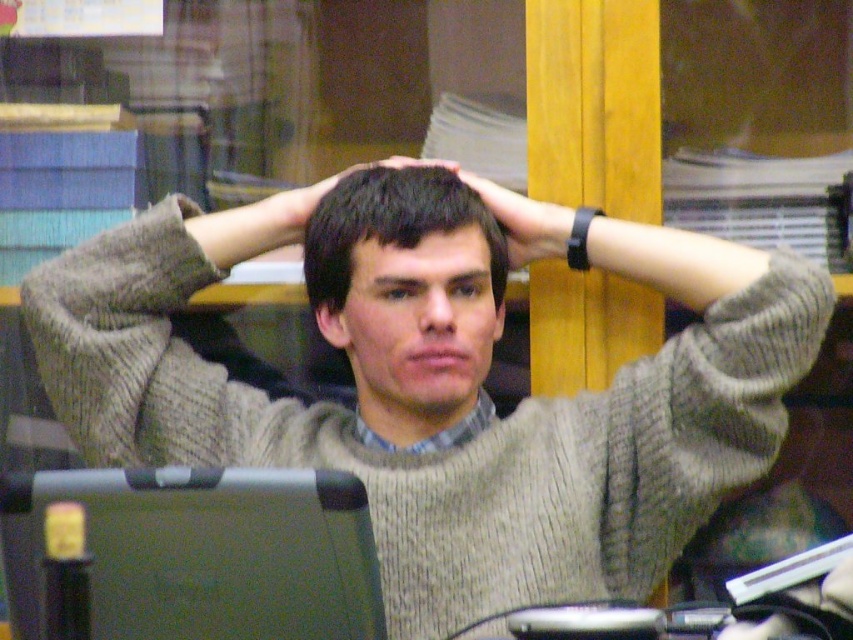
Is gray knitted sweater at center above dark brown hair at center?

No.

Is gray knitted sweater at center shorter than dark brown hair at center?

No.

Between point (451, 204) and point (320, 298), which one is positioned behind?

The point (320, 298) is behind.

At what (x,y) coordinates should I click in order to perform the action: click on gray knitted sweater at center. Please return your answer as a coordinate pair (x, y). Looking at the image, I should click on (440, 384).

Does gray knitted sweater at center have a lesser height compared to matte green laptop at lower left?

In fact, gray knitted sweater at center may be taller than matte green laptop at lower left.

What do you see at coordinates (440, 384) in the screenshot? The height and width of the screenshot is (640, 853). I see `gray knitted sweater at center` at bounding box center [440, 384].

Find the location of `gray knitted sweater at center`. gray knitted sweater at center is located at coordinates (440, 384).

Who is lower down, gray knitted sweater at center or black matte wristband at center?

Positioned lower is gray knitted sweater at center.

Who is more distant from viewer, [456,189] or [540,257]?

Point [540,257]

Who is more forward, (405, 184) or (532, 250)?

Point (405, 184)

At what (x,y) coordinates should I click in order to perform the action: click on gray knitted sweater at center. Please return your answer as a coordinate pair (x, y). Image resolution: width=853 pixels, height=640 pixels. Looking at the image, I should click on (440, 384).